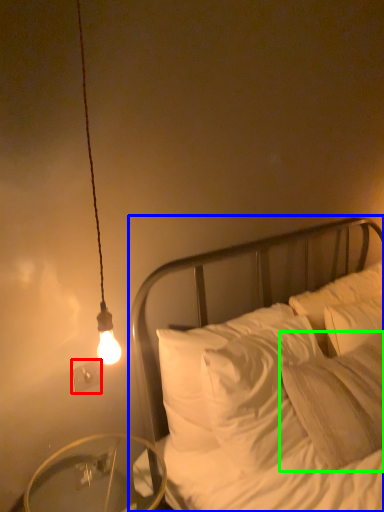
Question: Estimate the real-world distances between objects in this image. Which object is closer to electric outlet (highlighted by a red box), bed (highlighted by a blue box) or pillow (highlighted by a green box)?

Choices:
 (A) bed
 (B) pillow

Answer: (A)